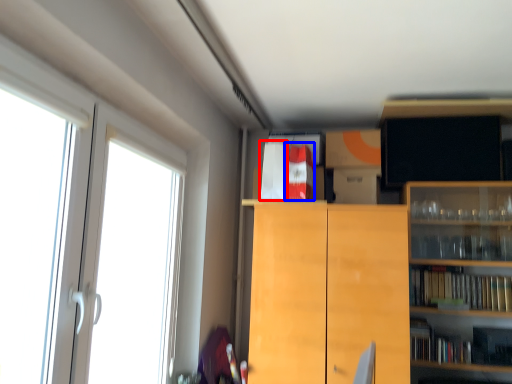
Question: Which point is closer to the camera, book (highlighted by a red box) or book (highlighted by a blue box)?

Choices:
 (A) book
 (B) book

Answer: (B)